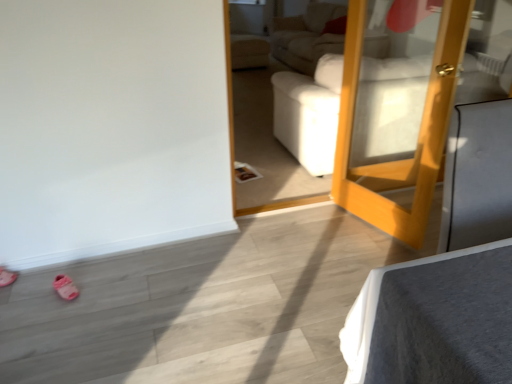
Identify the location of vacant space behind pink fabric shoe at lower left, which ranks as the first shoe in right-to-left order. tap(69, 269).